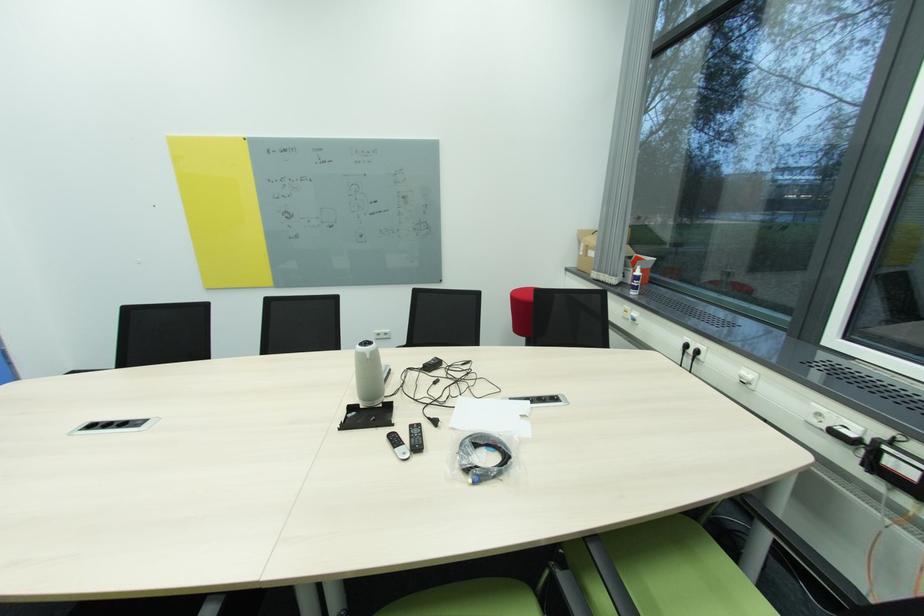
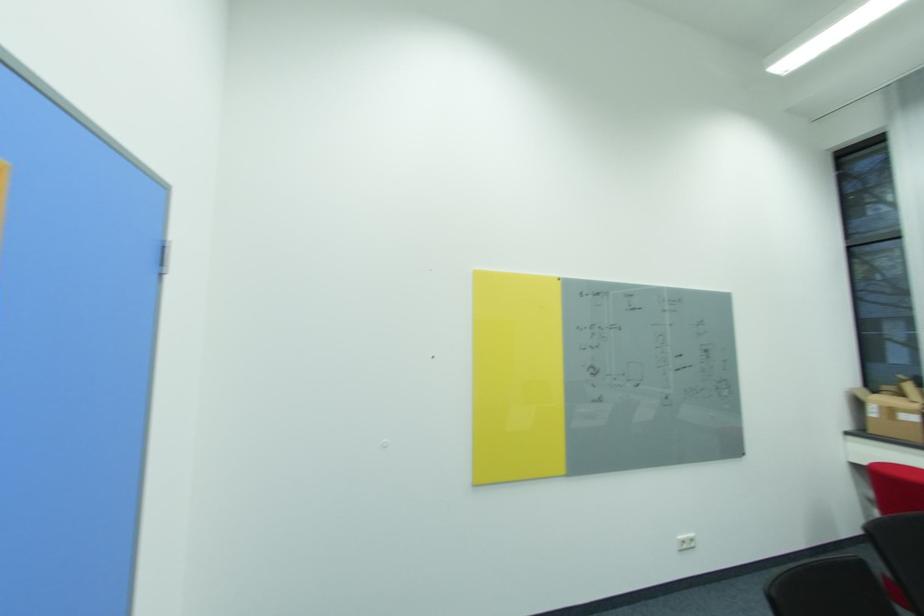
The point at (591, 249) is marked in the first image. Where is the corresponding point in the second image?

(895, 411)